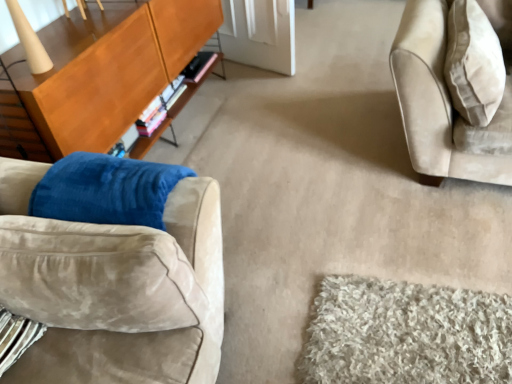
Question: From the image's perspective, is wooden cabinet at left located beneath suede couch at left?

Choices:
 (A) yes
 (B) no

Answer: (B)

Question: Would you say wooden cabinet at left is outside suede couch at left?

Choices:
 (A) no
 (B) yes

Answer: (B)

Question: Is wooden cabinet at left closer to camera compared to suede couch at left?

Choices:
 (A) yes
 (B) no

Answer: (B)

Question: From a real-world perspective, is wooden cabinet at left located beneath suede couch at left?

Choices:
 (A) yes
 (B) no

Answer: (A)

Question: From the image's perspective, is wooden cabinet at left on top of suede couch at left?

Choices:
 (A) yes
 (B) no

Answer: (A)

Question: Is beige fabric pillow at upper right taller or shorter than suede couch at left?

Choices:
 (A) short
 (B) tall

Answer: (B)

Question: From a real-world perspective, is beige fabric pillow at upper right physically located above or below suede couch at left?

Choices:
 (A) below
 (B) above

Answer: (A)

Question: In the image, is beige fabric pillow at upper right on the left side or the right side of suede couch at left?

Choices:
 (A) right
 (B) left

Answer: (A)

Question: From the image's perspective, is beige fabric pillow at upper right above or below suede couch at left?

Choices:
 (A) below
 (B) above

Answer: (B)

Question: In terms of height, does beige fabric pillow at upper right look taller or shorter compared to wooden cabinet at left?

Choices:
 (A) short
 (B) tall

Answer: (A)

Question: Looking at their shapes, would you say beige fabric pillow at upper right is wider or thinner than wooden cabinet at left?

Choices:
 (A) thin
 (B) wide

Answer: (B)

Question: Considering their positions, is beige fabric pillow at upper right located in front of or behind wooden cabinet at left?

Choices:
 (A) front
 (B) behind

Answer: (B)

Question: From the image's perspective, relative to wooden cabinet at left, is beige fabric pillow at upper right above or below?

Choices:
 (A) below
 (B) above

Answer: (A)

Question: Is suede couch at left in front of or behind beige fabric pillow at upper right in the image?

Choices:
 (A) front
 (B) behind

Answer: (A)

Question: From a real-world perspective, is suede couch at left positioned above or below beige fabric pillow at upper right?

Choices:
 (A) below
 (B) above

Answer: (B)